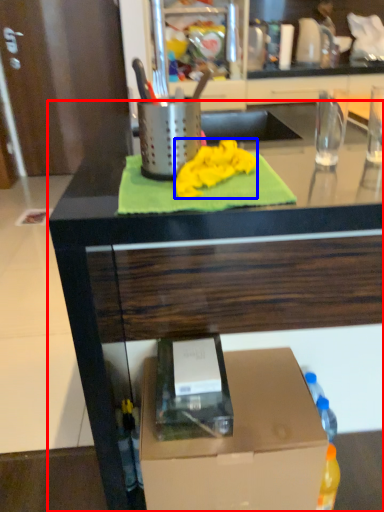
Question: Which object is closer to the camera taking this photo, countertop (highlighted by a red box) or cloth (highlighted by a blue box)?

Choices:
 (A) countertop
 (B) cloth

Answer: (A)